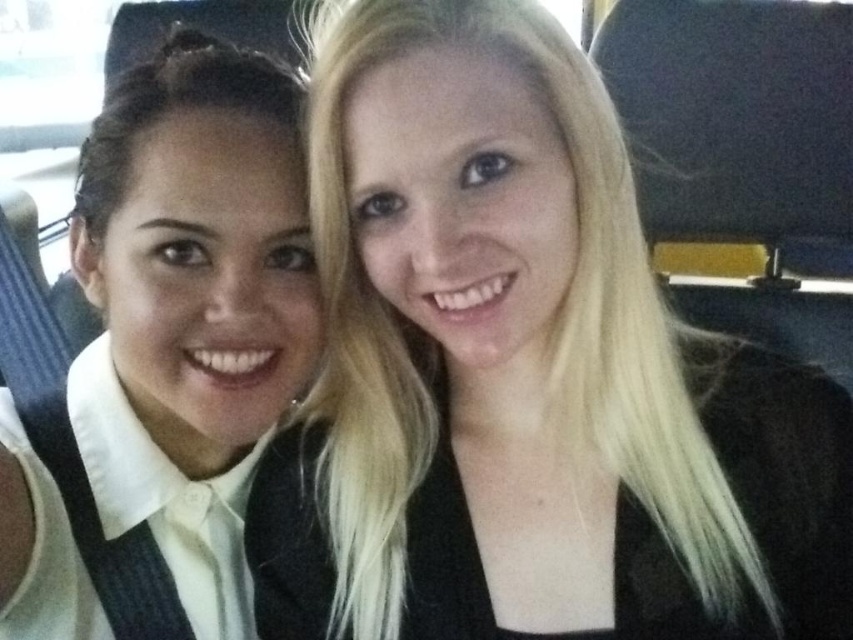
Question: Is white matte shirt at left above black leather seat at upper right?

Choices:
 (A) yes
 (B) no

Answer: (B)

Question: Which point is farther from the camera taking this photo?

Choices:
 (A) (599, 636)
 (B) (183, 237)

Answer: (B)

Question: Does white matte shirt at left appear on the left side of black leather seat at upper right?

Choices:
 (A) yes
 (B) no

Answer: (A)

Question: Does blonde hair at upper right appear on the right side of white matte shirt at left?

Choices:
 (A) yes
 (B) no

Answer: (A)

Question: Based on their relative distances, which object is farther from the black leather seat at upper right?

Choices:
 (A) white matte shirt at left
 (B) blonde hair at upper right

Answer: (A)

Question: Considering the real-world distances, which object is farthest from the white matte shirt at left?

Choices:
 (A) black leather seat at upper right
 (B) blonde hair at upper right

Answer: (A)